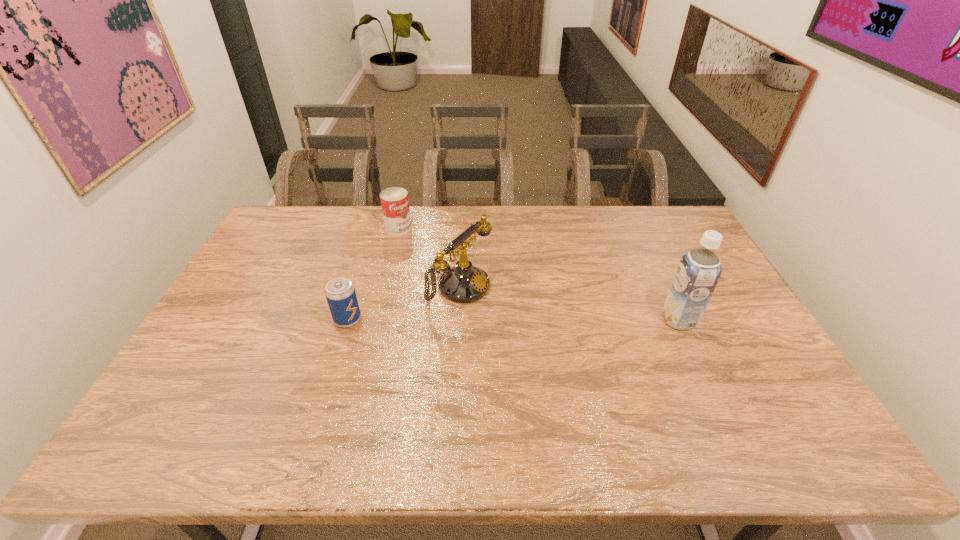
At what (x,y) coordinates should I click in order to perform the action: click on vacant space on the desktop that is between the beer can and the rightmost object and is positioned on the dial of the third object from left to right. Please return your answer as a coordinate pair (x, y). This screenshot has height=540, width=960. Looking at the image, I should click on (529, 320).

You are a GUI agent. You are given a task and a screenshot of the screen. Output one action in this format:
    pyautogui.click(x=<x>, y=<y>)
    Task: Click on the vacant space on the desktop that is between the beer can and the soya milk and is positioned on the front label of the can
    This screenshot has height=540, width=960.
    Given the screenshot: What is the action you would take?
    pyautogui.click(x=506, y=320)